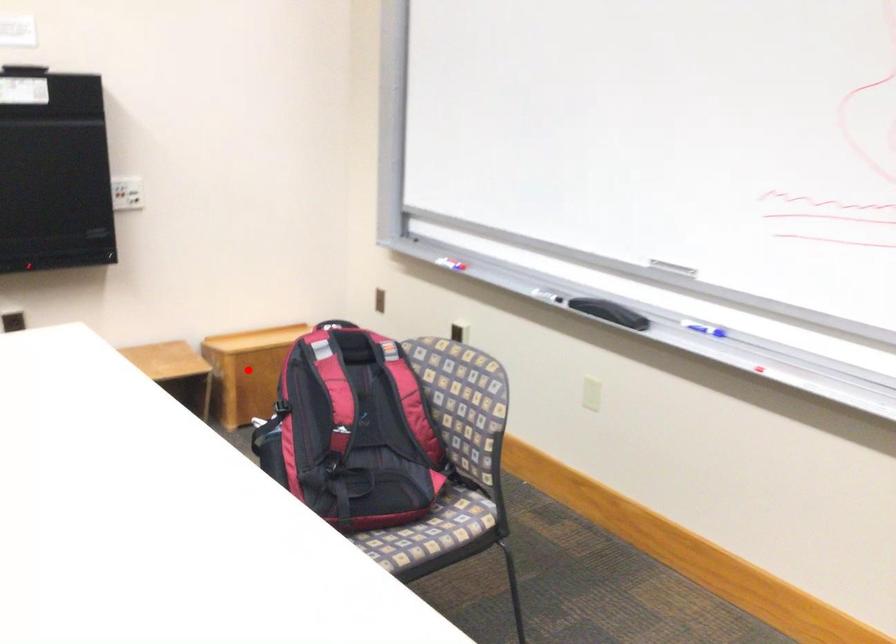
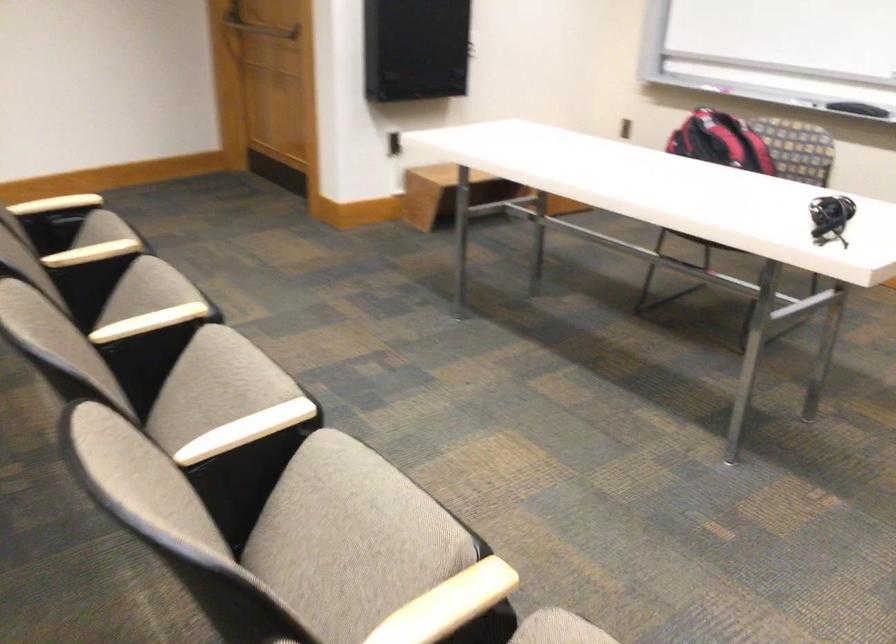
Question: I am providing you with two images of the same scene from different viewpoints. A red point is marked on the first image. At the location where the point appears in image 1, is it still visible in image 2?

Choices:
 (A) Yes
 (B) No

Answer: (B)